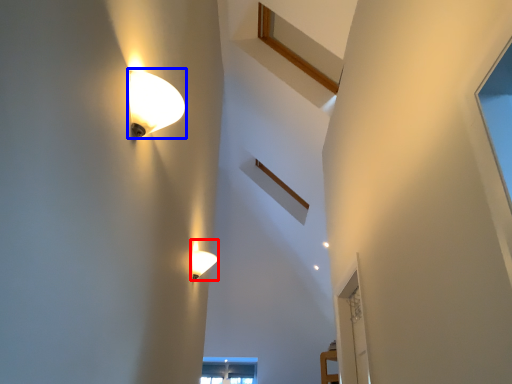
Question: Which of the following is the closest to the observer, lamp (highlighted by a red box) or lamp (highlighted by a blue box)?

Choices:
 (A) lamp
 (B) lamp

Answer: (B)